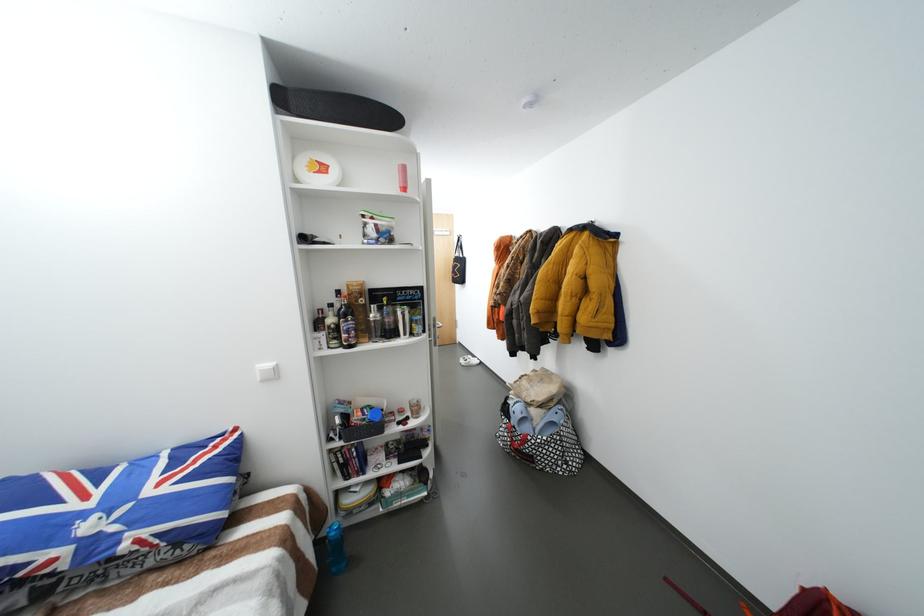
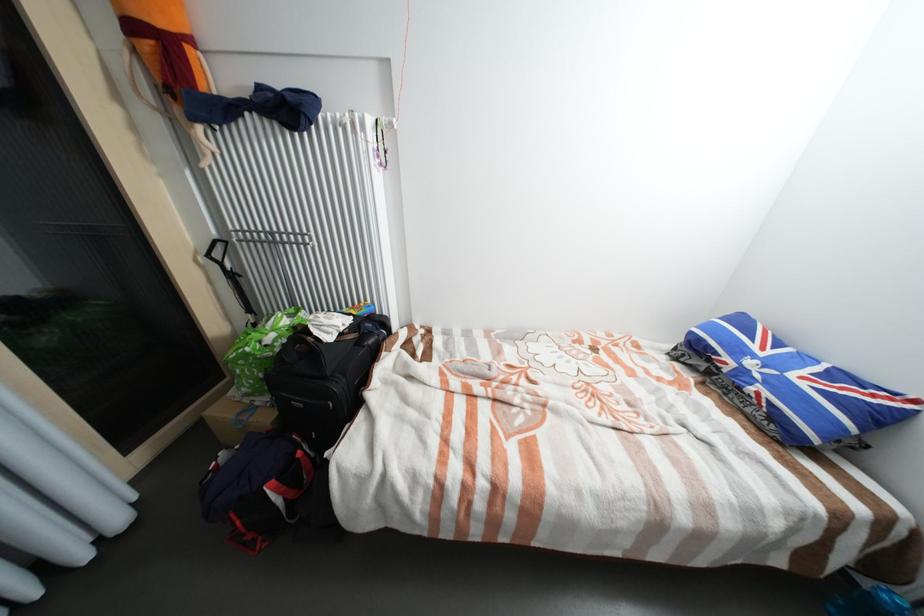
Locate, in the second image, the point that corresponds to (x=98, y=505) in the first image.

(769, 354)